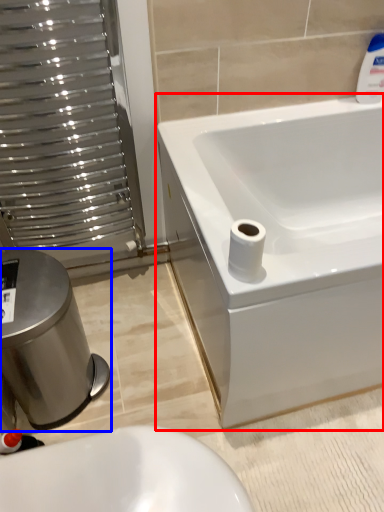
Question: Which object appears farthest to the camera in this image, bathtub (highlighted by a red box) or bidet (highlighted by a blue box)?

Choices:
 (A) bathtub
 (B) bidet

Answer: (B)